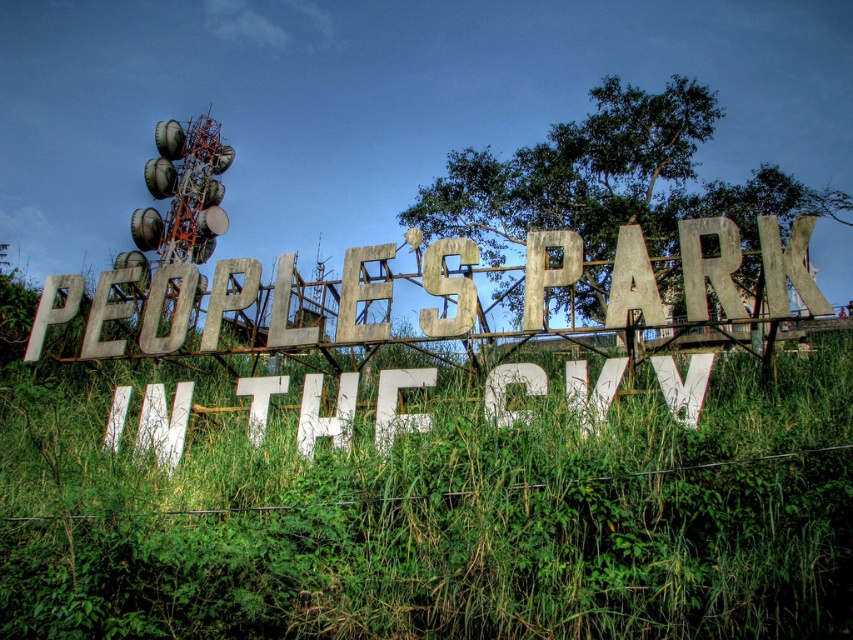
Question: Is green grass at center closer to the viewer compared to rusty metal fence at center?

Choices:
 (A) yes
 (B) no

Answer: (A)

Question: Which point appears farthest from the camera in this image?

Choices:
 (A) (370, 285)
 (B) (294, 580)

Answer: (A)

Question: Is green grass at center closer to camera compared to rusty metal fence at center?

Choices:
 (A) no
 (B) yes

Answer: (B)

Question: Which point appears farthest from the camera in this image?

Choices:
 (A) 236,308
 (B) 796,544

Answer: (A)

Question: Is green grass at center further to camera compared to rusty metal fence at center?

Choices:
 (A) no
 (B) yes

Answer: (A)